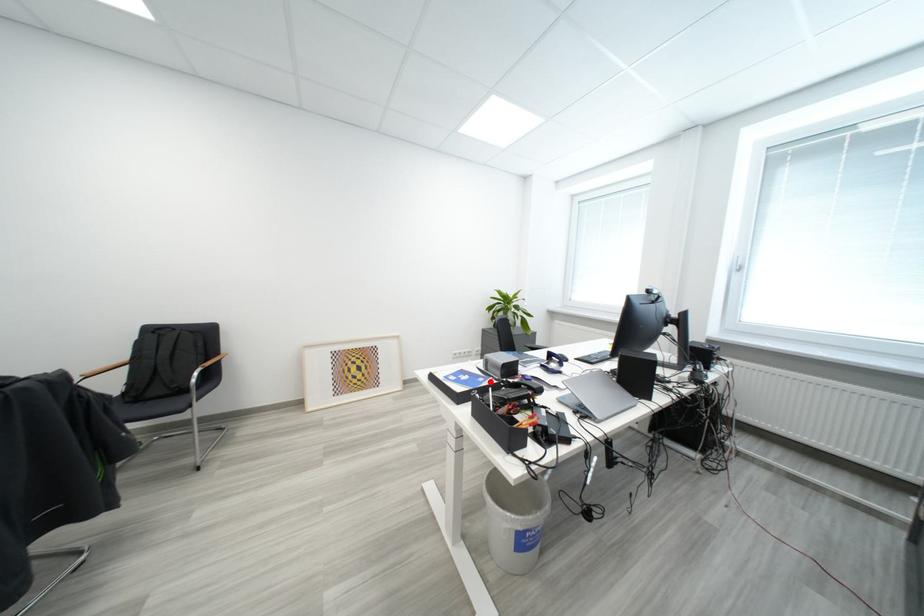
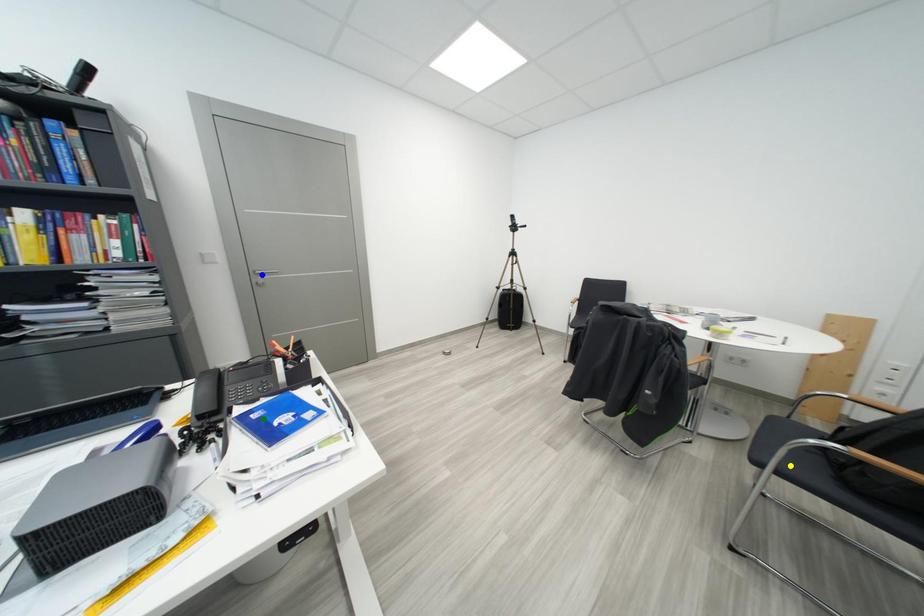
Question: I am providing you with two images of the same scene from different viewpoints. A red point is marked on the first image. You are given multiple points on the second image. In image 2, which mark is for the same physical point as the one in image 1?

Choices:
 (A) yellow point
 (B) green point
 (C) blue point

Answer: (B)